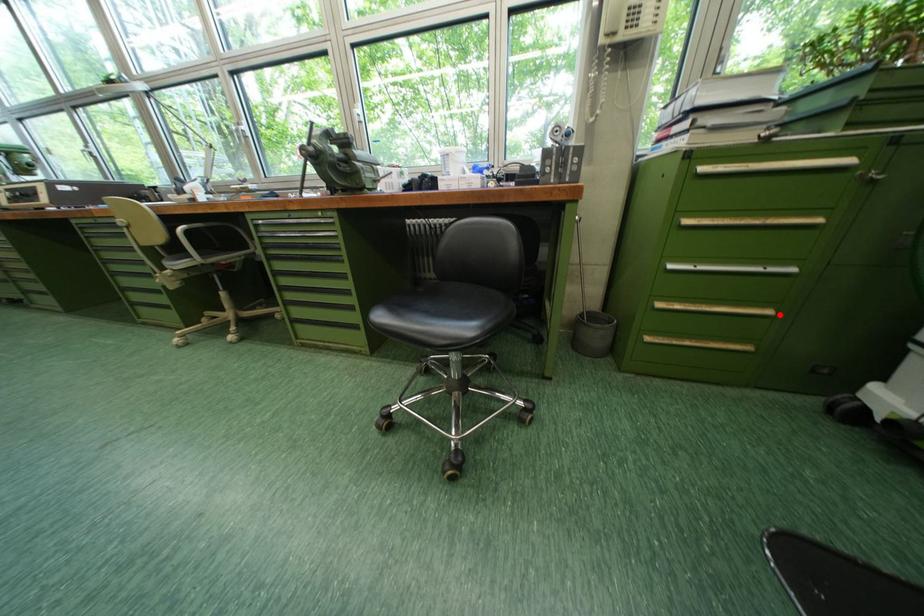
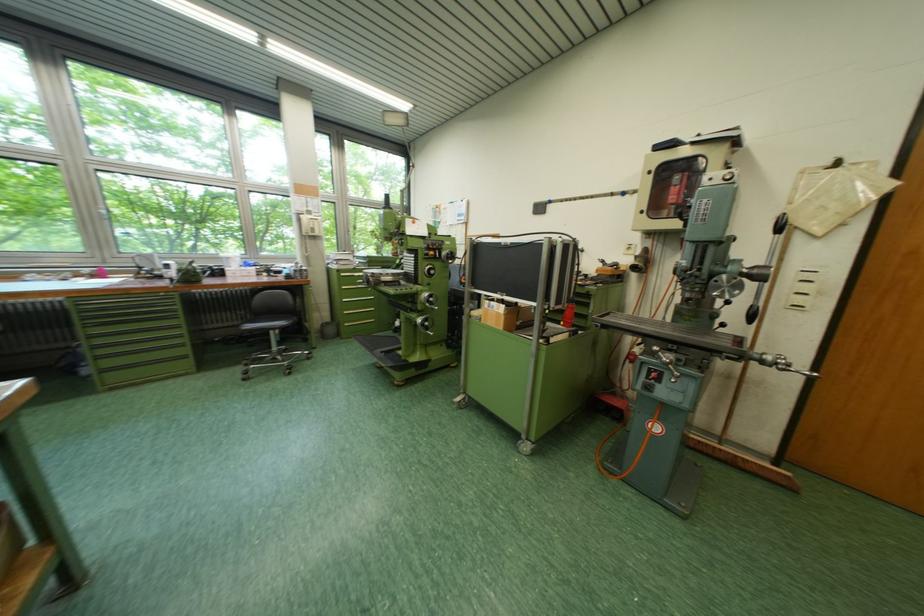
Question: I am providing you with two images of the same scene from different viewpoints. Given a red point in image1, look at the same physical point in image2. Is it:

Choices:
 (A) Closer to the viewpoint
 (B) Farther from the viewpoint

Answer: (B)